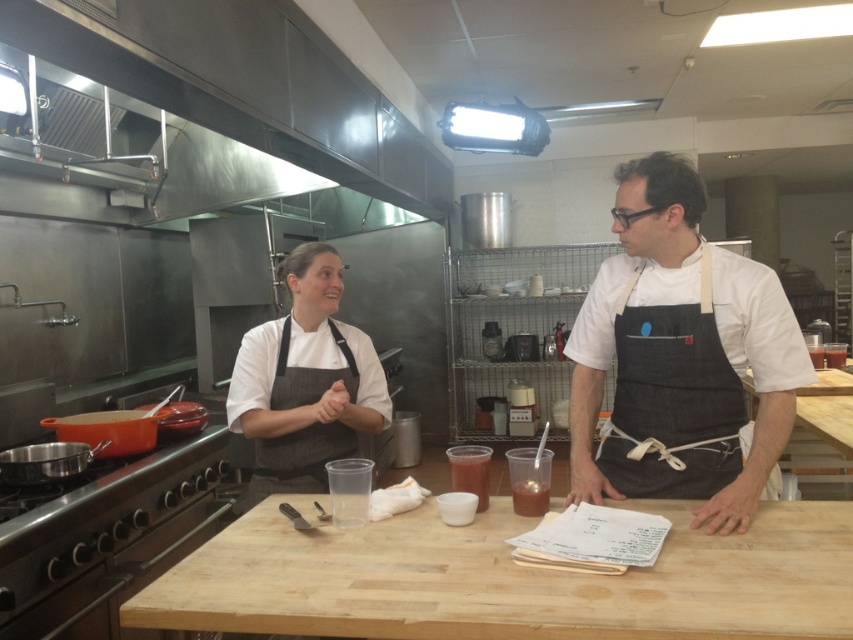
You are a new chef in the kitchen and need to choose an apron that is larger for better coverage. Which apron should you pick between the black canvas apron at center and the denim apron at center?

The black canvas apron at center is bigger than the denim apron at center, so you should choose the black canvas apron at center for better coverage.

In the scene shown: You are a chef in this kitchen and need to choose an apron that reaches your knees. Which apron between the dark gray apron at center and the matte gray apron at center is longer?

The dark gray apron at center has a greater height compared to the matte gray apron at center, so it is the longer apron and would reach your knees.